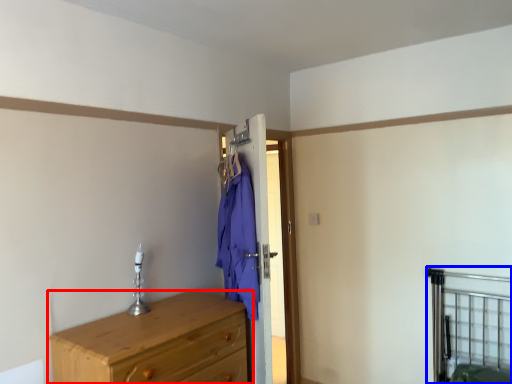
Question: Which object appears closest to the camera in this image, chest of drawers (highlighted by a red box) or bed frame (highlighted by a blue box)?

Choices:
 (A) chest of drawers
 (B) bed frame

Answer: (A)